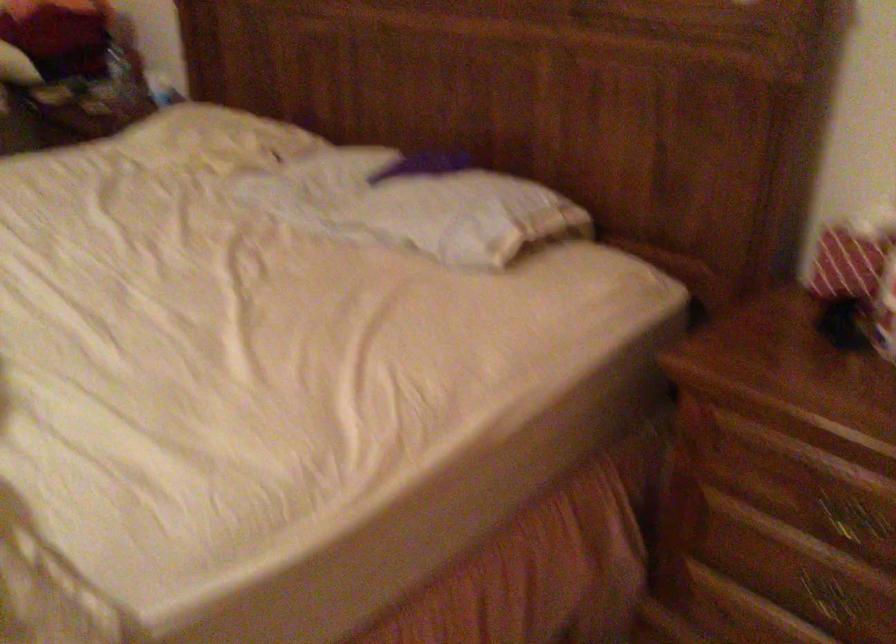
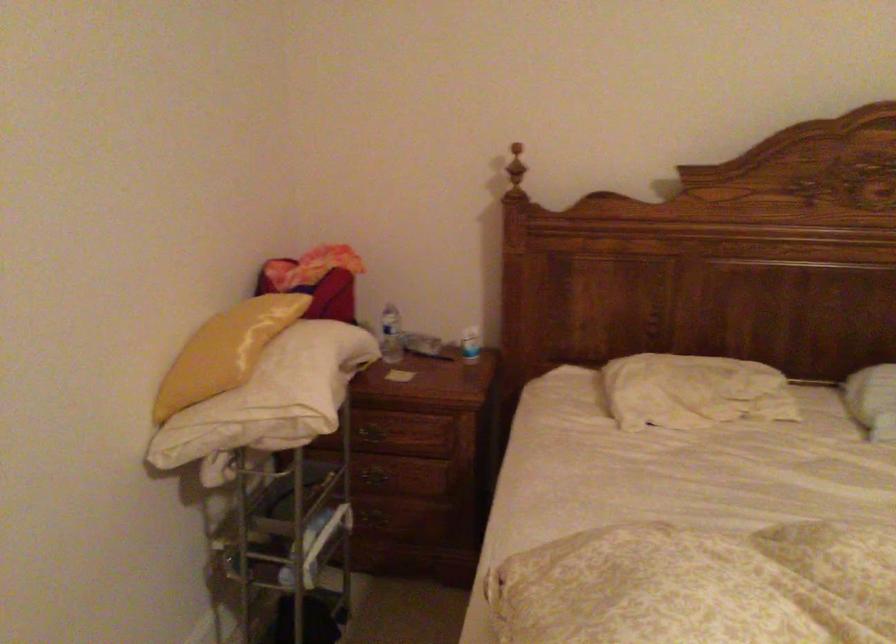
In the second image, find the point that corresponds to [165,82] in the first image.

(470, 344)